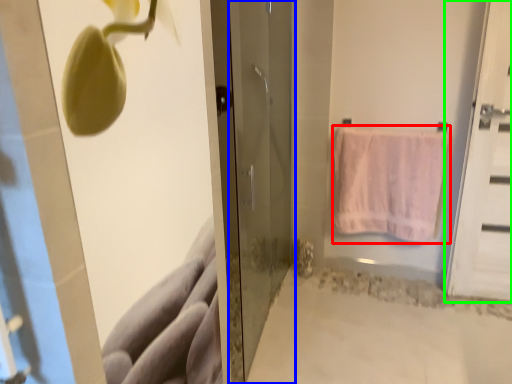
Question: Which is nearer to the towel (highlighted by a red box)? door (highlighted by a blue box) or door (highlighted by a green box).

Choices:
 (A) door
 (B) door

Answer: (B)